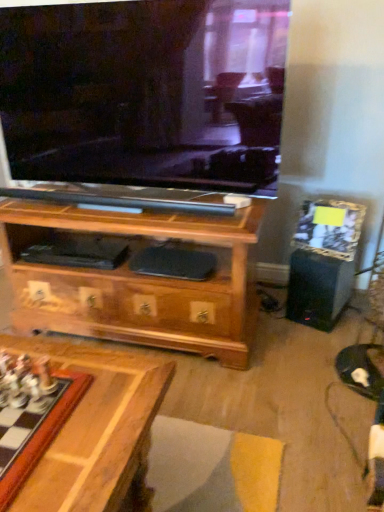
Where is `free spot in front of black plastic speaker at right`? This screenshot has height=512, width=384. free spot in front of black plastic speaker at right is located at coordinates (314, 345).